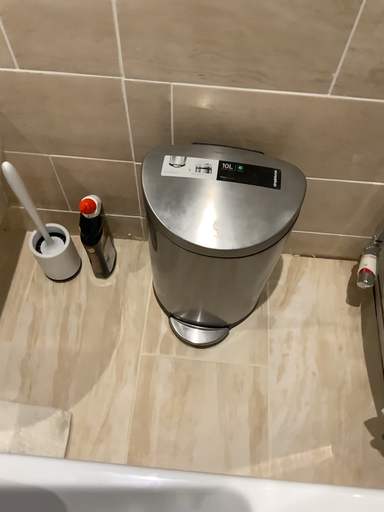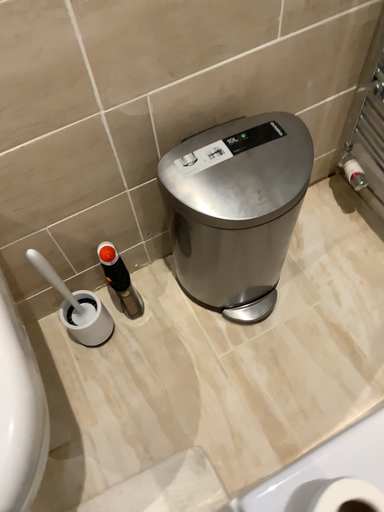
Question: Which way did the camera rotate in the video?

Choices:
 (A) rotated right
 (B) rotated left

Answer: (A)